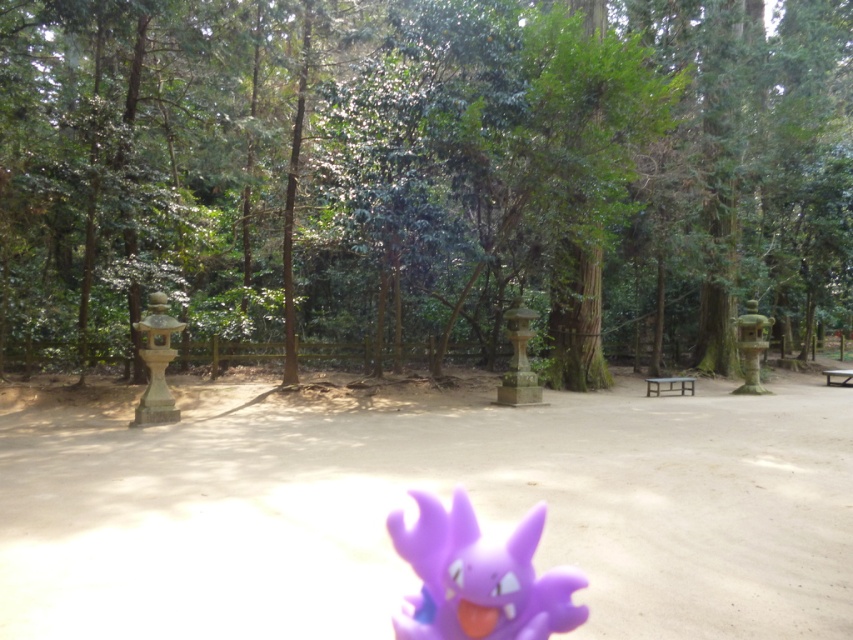
Question: Which is farther from the wooden picnic table at center?

Choices:
 (A) green matte tree at center
 (B) purple rubber toy at lower center

Answer: (B)

Question: Can you confirm if green matte tree at center is positioned to the right of matte stone lantern at right?

Choices:
 (A) yes
 (B) no

Answer: (B)

Question: Is green matte tree at center positioned in front of matte stone lantern at right?

Choices:
 (A) yes
 (B) no

Answer: (A)

Question: Does green matte tree at center appear on the left side of wooden picnic table at center?

Choices:
 (A) yes
 (B) no

Answer: (A)

Question: Among these objects, which one is farthest from the camera?

Choices:
 (A) metallic silver picnic table at right
 (B) matte stone lantern at right

Answer: (A)

Question: Which is nearer to the wooden picnic table at center?

Choices:
 (A) metallic silver picnic table at right
 (B) matte stone lantern at right

Answer: (B)